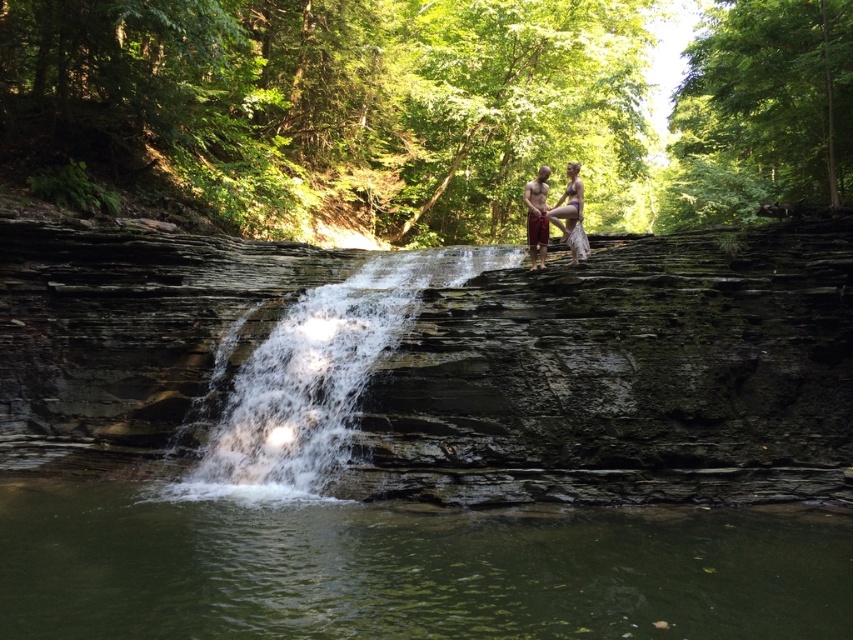
Looking at this image, you are standing at the edge of the waterfall and see the clear water at center and the matte white dress at center. Which object is shorter in height?

The clear water at center has a lesser height compared to the matte white dress at center, so the clear water at center is shorter in height.

You are standing at the point marked by the coordinates point (x=318, y=378). Based on the scene description, what is the immediate surface you are standing on?

The immediate surface at point (x=318, y=378) is clear water at center, as the point is located on clear water at center.

You are a photographer planning to capture the serene waterfall scene. You notice the clear water at center and the matte skin couple at center. Which object takes up more area in the image?

The matte skin couple at center occupies more area than the clear water at center in the image.